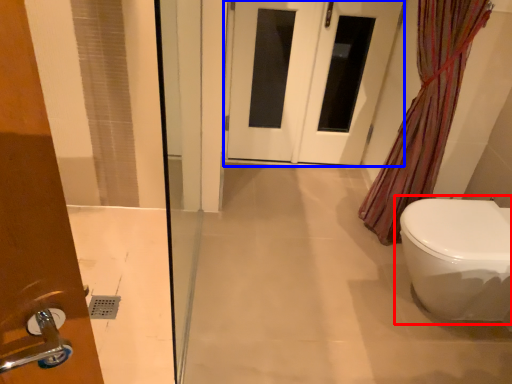
Question: Which object appears closest to the camera in this image, toilet (highlighted by a red box) or door (highlighted by a blue box)?

Choices:
 (A) toilet
 (B) door

Answer: (A)